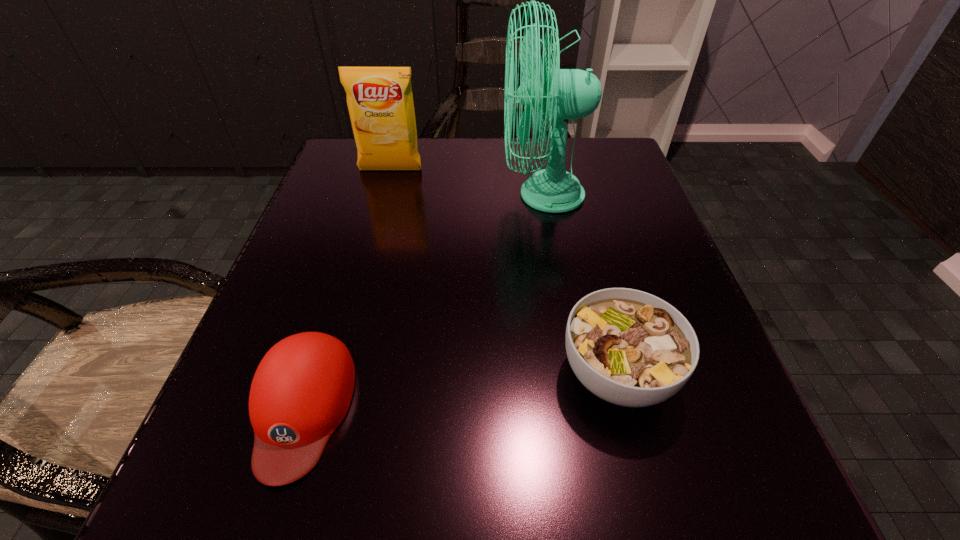
I want to click on vacant region that satisfies the following two spatial constraints: 1. in front of the tallest object to blow air; 2. on the right side of the soup bowl, so click(x=574, y=374).

At what (x,y) coordinates should I click in order to perform the action: click on blank space that satisfies the following two spatial constraints: 1. on the front of the second tallest object with the logo; 2. on the left side of the soup bowl. Please return your answer as a coordinate pair (x, y). Looking at the image, I should click on (337, 374).

The image size is (960, 540). I want to click on vacant space that satisfies the following two spatial constraints: 1. in front of the tallest object to blow air; 2. on the left side of the soup bowl, so point(574,374).